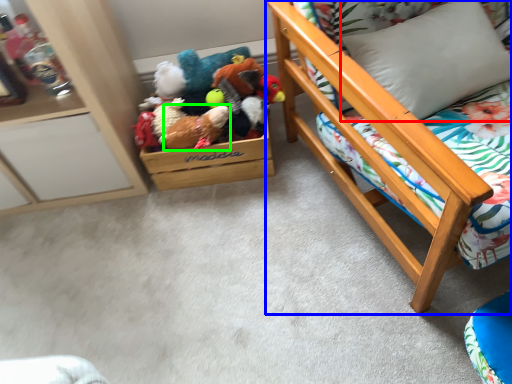
Question: Considering the real-world distances, which object is closest to pillow (highlighted by a red box)? furniture (highlighted by a blue box) or toy (highlighted by a green box).

Choices:
 (A) furniture
 (B) toy

Answer: (A)